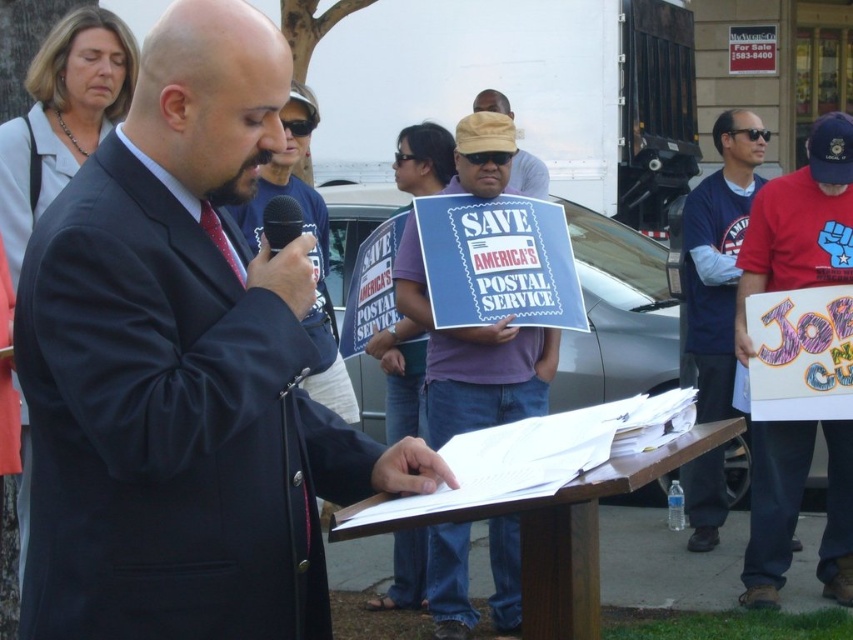
Which is below, red cotton shirt at right or tan straw hat at center?

red cotton shirt at right

Is point (793, 497) closer to camera compared to point (523, 150)?

Yes, it is.

Find the location of a particular element. The height and width of the screenshot is (640, 853). red cotton shirt at right is located at coordinates (799, 225).

Does tan straw hat at center appear on the right side of black matte microphone at center?

Indeed, tan straw hat at center is positioned on the right side of black matte microphone at center.

Which of these two, tan straw hat at center or black matte microphone at center, stands taller?

tan straw hat at center is taller.

The width and height of the screenshot is (853, 640). In order to click on tan straw hat at center in this screenshot , I will do `click(527, 176)`.

Who is positioned more to the right, matte black suit at center or black matte microphone at center?

black matte microphone at center

Does matte black suit at center appear on the left side of black matte microphone at center?

Yes, matte black suit at center is to the left of black matte microphone at center.

Identify the location of matte black suit at center. The width and height of the screenshot is (853, 640). click(x=183, y=369).

Where is `matte black suit at center`? matte black suit at center is located at coordinates (183, 369).